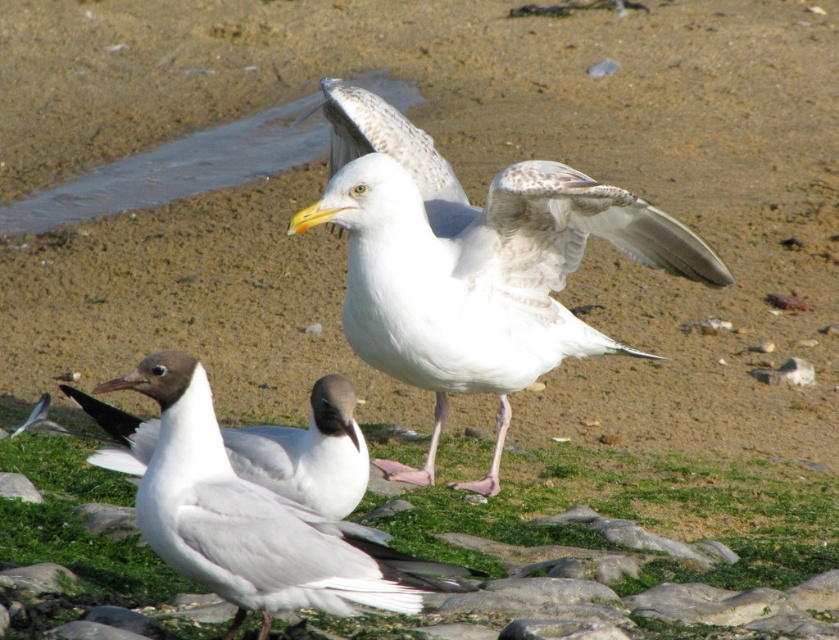
Does white matte bird at center have a greater height compared to white matte/glossy seagull at center?

Correct, white matte bird at center is much taller as white matte/glossy seagull at center.

Which is behind, point (271, 513) or point (311, 449)?

Point (311, 449)

Which is behind, point (243, 576) or point (322, 433)?

The point (322, 433) is more distant.

Identify the location of white matte bird at center. (254, 518).

Measure the distance between white feathered bird at center and green grass at center.

The distance of white feathered bird at center from green grass at center is 29.09 inches.

Can you confirm if white feathered bird at center is wider than green grass at center?

Incorrect, white feathered bird at center's width does not surpass green grass at center's.

Is point (490, 312) closer to viewer compared to point (671, 461)?

Yes, it is.

Where is `white feathered bird at center`? white feathered bird at center is located at coordinates (472, 262).

Does green grass at center have a greater height compared to white matte/glossy seagull at center?

No.

Does green grass at center lie in front of white matte/glossy seagull at center?

No, it is not.

Which is behind, point (835, 500) or point (233, 452)?

Point (835, 500)

You are a GUI agent. You are given a task and a screenshot of the screen. Output one action in this format:
    pyautogui.click(x=<x>, y=<y>)
    Task: Click on the green grass at center
    This screenshot has height=640, width=839.
    Given the screenshot: What is the action you would take?
    pyautogui.click(x=645, y=518)